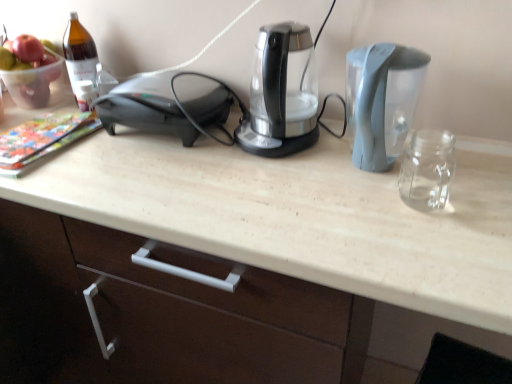
Question: Can you confirm if black plastic toaster at left is wider than translucent glass bowl at upper left?

Choices:
 (A) no
 (B) yes

Answer: (B)

Question: From the image's perspective, is black plastic toaster at left on translucent glass bowl at upper left?

Choices:
 (A) no
 (B) yes

Answer: (A)

Question: Is black plastic toaster at left far from translucent glass bowl at upper left?

Choices:
 (A) yes
 (B) no

Answer: (B)

Question: From the image's perspective, is black plastic toaster at left beneath translucent glass bowl at upper left?

Choices:
 (A) no
 (B) yes

Answer: (B)

Question: From a real-world perspective, is black plastic toaster at left positioned under translucent glass bowl at upper left based on gravity?

Choices:
 (A) yes
 (B) no

Answer: (A)

Question: In terms of size, does brown glass bottle at upper left appear bigger or smaller than gray plastic water at right, placed as the 2th kitchen appliance when sorted from left to right?

Choices:
 (A) big
 (B) small

Answer: (B)

Question: From the image's perspective, is brown glass bottle at upper left above or below gray plastic water at right, positioned as the 1th kitchen appliance in right-to-left order?

Choices:
 (A) above
 (B) below

Answer: (A)

Question: Based on their positions, is brown glass bottle at upper left located to the left or right of gray plastic water at right, positioned as the 1th kitchen appliance in right-to-left order?

Choices:
 (A) left
 (B) right

Answer: (A)

Question: Considering the positions of point (74, 46) and point (373, 81), is point (74, 46) closer or farther from the camera than point (373, 81)?

Choices:
 (A) closer
 (B) farther

Answer: (B)

Question: Considering the positions of translucent glass bowl at upper left and black plastic toaster at left in the image, is translucent glass bowl at upper left taller or shorter than black plastic toaster at left?

Choices:
 (A) tall
 (B) short

Answer: (A)

Question: From the image's perspective, is translucent glass bowl at upper left positioned above or below black plastic toaster at left?

Choices:
 (A) below
 (B) above

Answer: (B)

Question: From a real-world perspective, is translucent glass bowl at upper left physically located above or below black plastic toaster at left?

Choices:
 (A) below
 (B) above

Answer: (B)

Question: Is translucent glass bowl at upper left in front of or behind black plastic toaster at left in the image?

Choices:
 (A) behind
 (B) front

Answer: (A)

Question: From a real-world perspective, is brown glass bottle at upper left above or below translucent glass bowl at upper left?

Choices:
 (A) below
 (B) above

Answer: (B)

Question: Is point (71, 77) closer or farther from the camera than point (29, 69)?

Choices:
 (A) closer
 (B) farther

Answer: (A)